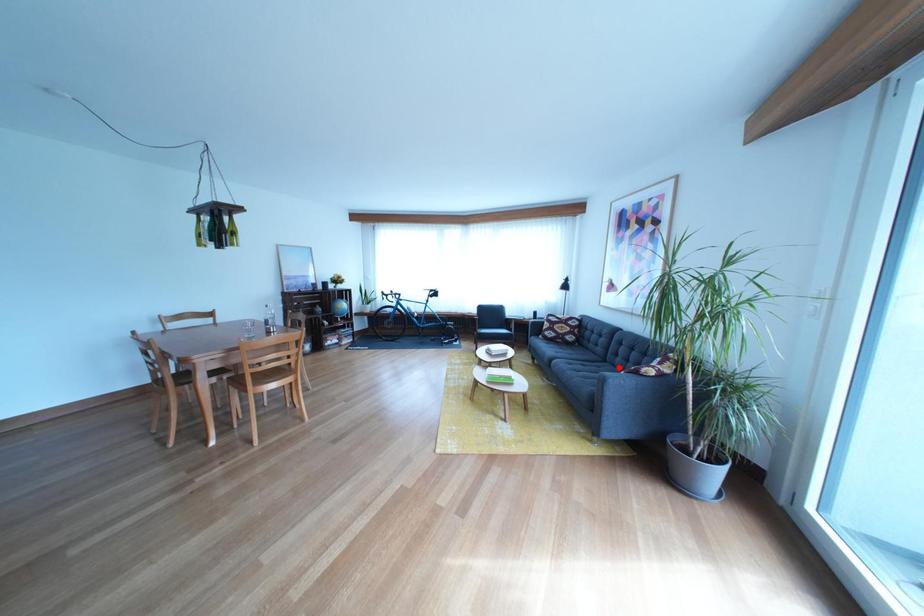
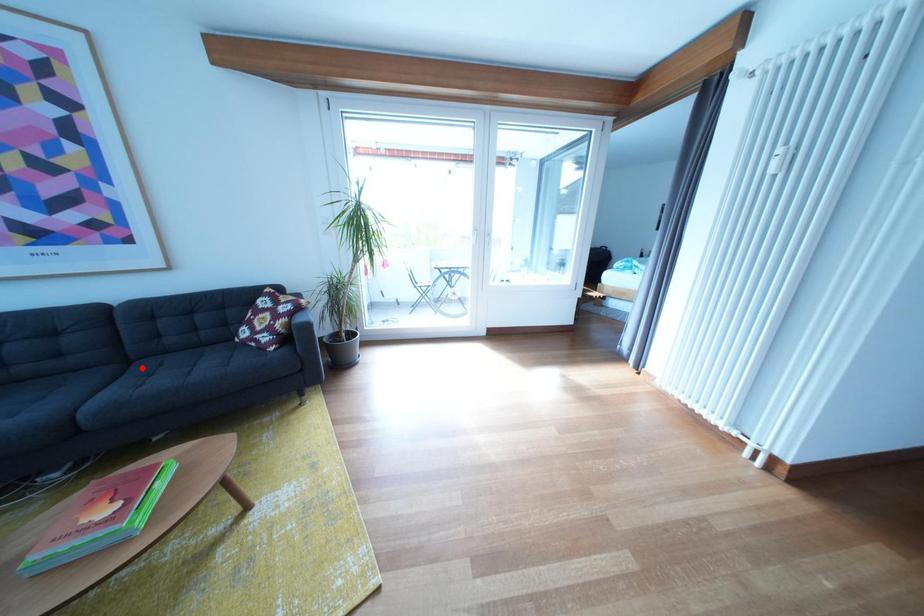
I am providing you with two images of the same scene from different viewpoints. A red point is marked on the first image and another point is marked on the second image. Does the point marked in image1 correspond to the same location as the one in image2?

Yes